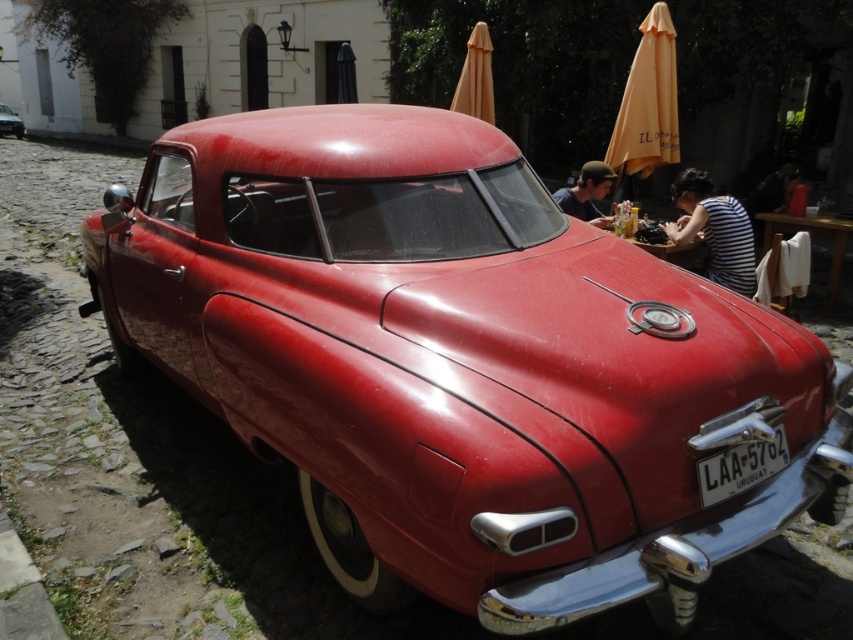
Question: Is metallic silver license plate at lower center bigger than matte black hair at upper center?

Choices:
 (A) yes
 (B) no

Answer: (B)

Question: Is matte black hair at upper center to the right of shiny red car at center from the viewer's perspective?

Choices:
 (A) yes
 (B) no

Answer: (A)

Question: Estimate the real-world distances between objects in this image. Which object is farther from the matte black hair at upper center?

Choices:
 (A) metallic silver license plate at lower center
 (B) shiny red car at center
 (C) smooth black shirt at upper right

Answer: (B)

Question: Which object is farther from the camera taking this photo?

Choices:
 (A) metallic silver license plate at lower center
 (B) smooth black shirt at upper right
 (C) matte black hair at upper center
 (D) striped fabric shirt at center

Answer: (B)

Question: Which point is closer to the camera?

Choices:
 (A) (680, 243)
 (B) (792, 189)
 (C) (761, 472)
 (D) (589, 186)

Answer: (C)

Question: Is matte black hair at upper center above smooth black shirt at upper right?

Choices:
 (A) no
 (B) yes

Answer: (A)